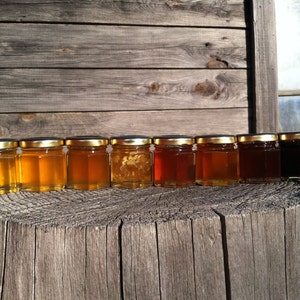
Image resolution: width=300 pixels, height=300 pixels. I want to click on bottom edge of jars, so click(x=274, y=180), click(x=231, y=184), click(x=168, y=185), click(x=130, y=187), click(x=95, y=188), click(x=50, y=189), click(x=1, y=192), click(x=295, y=179).